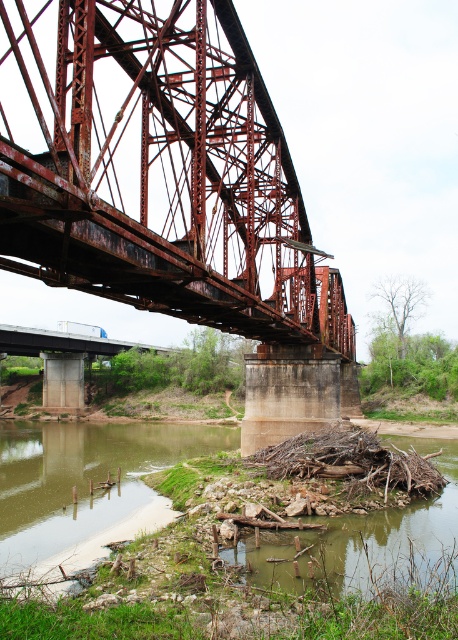
You are standing on the steel truss bridge and looking down at the river and its banks. Which object is closer to you, the green mossy riverbank at lower left or the brown muddy river at lower center?

The green mossy riverbank at lower left is closer to you because it is further to the viewer than the brown muddy river at lower center.

You are standing at the point marked by the coordinates point (x=170, y=189) on the image. Which object are you directly at?

You are directly at the rusty metal bridge at center, as the point (x=170, y=189) marks its location.